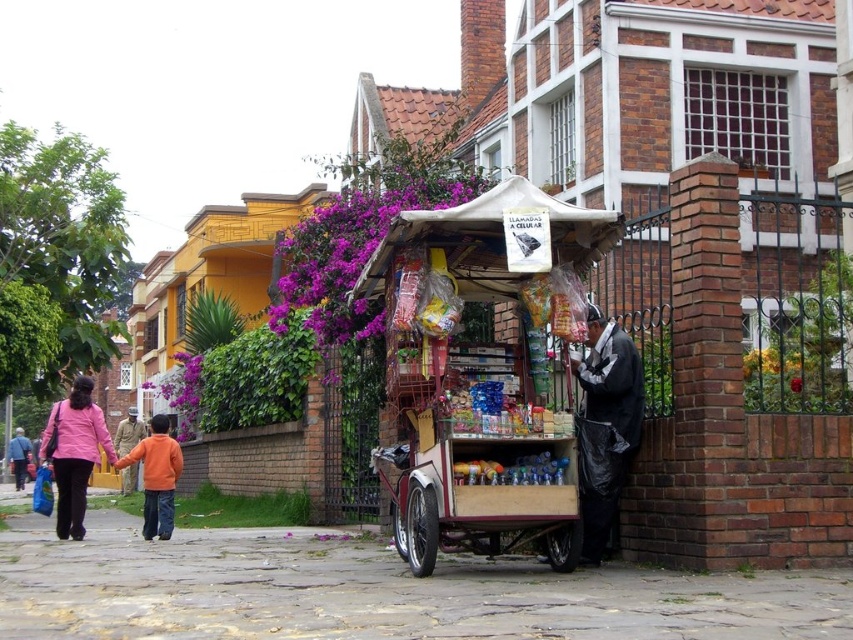
Which is behind, point (119, 586) or point (100, 432)?

Point (100, 432)

Describe the element at coordinates (374, 592) in the screenshot. I see `paved stone at lower left` at that location.

You are a GUI agent. You are given a task and a screenshot of the screen. Output one action in this format:
    pyautogui.click(x=<x>, y=<y>)
    Task: Click on the paved stone at lower left
    
    Given the screenshot: What is the action you would take?
    pyautogui.click(x=374, y=592)

Image resolution: width=853 pixels, height=640 pixels. What are the coordinates of `paved stone at lower left` in the screenshot? It's located at (374, 592).

Does paved stone at lower left lie in front of black plastic bag at lower right?

Yes, paved stone at lower left is closer to the viewer.

Can you confirm if paved stone at lower left is positioned above black plastic bag at lower right?

Actually, paved stone at lower left is below black plastic bag at lower right.

Identify the location of paved stone at lower left. Image resolution: width=853 pixels, height=640 pixels. (374, 592).

At what (x,y) coordinates should I click in order to perform the action: click on paved stone at lower left. Please return your answer as a coordinate pair (x, y). Looking at the image, I should click on (374, 592).

Which is more to the left, wooden cart at center or orange cotton shirt at lower left?

orange cotton shirt at lower left

Does point (445, 531) lie in front of point (125, 476)?

Yes, point (445, 531) is closer to viewer.

You are a GUI agent. You are given a task and a screenshot of the screen. Output one action in this format:
    pyautogui.click(x=<x>, y=<y>)
    Task: Click on the wooden cart at center
    
    Given the screenshot: What is the action you would take?
    click(x=453, y=368)